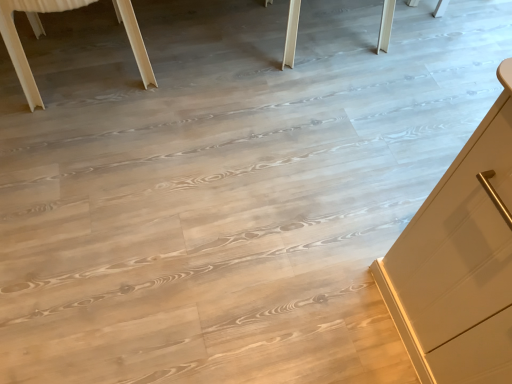
Locate an element on the screen. vacant area that is in front of light wood table at upper left is located at coordinates (76, 141).